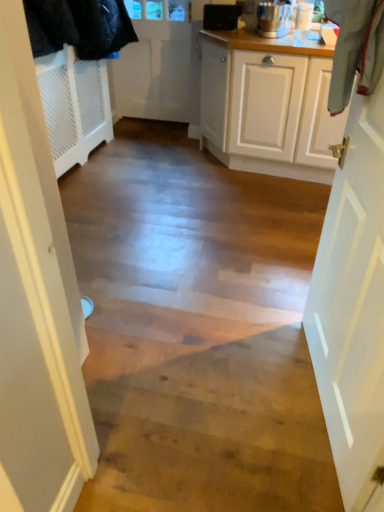
Question: Are white matte door at right, the first door positioned from the bottom, and white matte door at upper center, marked as the 1th door in a top-to-bottom arrangement, located far from each other?

Choices:
 (A) no
 (B) yes

Answer: (B)

Question: Can you confirm if white matte door at right, acting as the 2th door starting from the top, is positioned to the right of white matte door at upper center, placed as the 1th door when sorted from left to right?

Choices:
 (A) yes
 (B) no

Answer: (A)

Question: From the image's perspective, is white matte door at right, acting as the 2th door starting from the top, over white matte door at upper center, which ranks as the first door in back-to-front order?

Choices:
 (A) no
 (B) yes

Answer: (A)

Question: Considering the relative sizes of white matte door at right, the first door positioned from the bottom, and white matte door at upper center, placed as the 1th door when sorted from left to right, in the image provided, is white matte door at right, the first door positioned from the bottom, taller than white matte door at upper center, placed as the 1th door when sorted from left to right,?

Choices:
 (A) no
 (B) yes

Answer: (A)

Question: Is white matte door at right, acting as the 2th door starting from the top, closer to camera compared to white matte door at upper center, the second door from the front?

Choices:
 (A) no
 (B) yes

Answer: (B)

Question: Is white matte door at right, the second door in the back-to-front sequence, not inside white matte door at upper center, the second door from the front?

Choices:
 (A) no
 (B) yes

Answer: (B)

Question: Considering the relative sizes of polished stainless steel blender at upper right and white matte door at upper center, the second door positioned from the right, in the image provided, is polished stainless steel blender at upper right shorter than white matte door at upper center, the second door positioned from the right,?

Choices:
 (A) no
 (B) yes

Answer: (B)

Question: Can we say polished stainless steel blender at upper right lies outside white matte door at upper center, which ranks as the first door in back-to-front order?

Choices:
 (A) yes
 (B) no

Answer: (A)

Question: From a real-world perspective, is polished stainless steel blender at upper right positioned under white matte door at upper center, marked as the 1th door in a top-to-bottom arrangement, based on gravity?

Choices:
 (A) no
 (B) yes

Answer: (A)

Question: Is polished stainless steel blender at upper right to the right of white matte door at upper center, which ranks as the first door in back-to-front order, from the viewer's perspective?

Choices:
 (A) no
 (B) yes

Answer: (B)

Question: Is polished stainless steel blender at upper right oriented away from white matte door at upper center, which ranks as the first door in back-to-front order?

Choices:
 (A) no
 (B) yes

Answer: (A)

Question: Does polished stainless steel blender at upper right appear on the left side of white matte door at upper center, the second door from the front?

Choices:
 (A) no
 (B) yes

Answer: (A)

Question: Can we say white matte door at right, the second door in the back-to-front sequence, lies outside black plastic speaker at upper center?

Choices:
 (A) yes
 (B) no

Answer: (A)